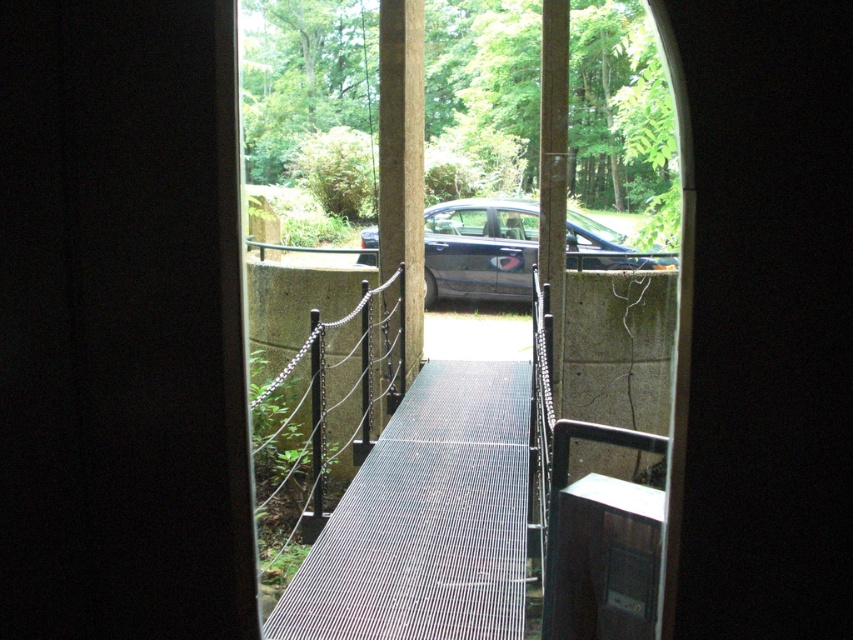
Question: Can you confirm if metallic grid walkway at center is positioned to the right of glossy metallic car at center?

Choices:
 (A) no
 (B) yes

Answer: (A)

Question: Which point is closer to the camera taking this photo?

Choices:
 (A) (410, 502)
 (B) (497, 248)

Answer: (A)

Question: Does metallic grid walkway at center have a smaller size compared to glossy metallic car at center?

Choices:
 (A) no
 (B) yes

Answer: (A)

Question: Is metallic grid walkway at center positioned in front of glossy metallic car at center?

Choices:
 (A) yes
 (B) no

Answer: (A)